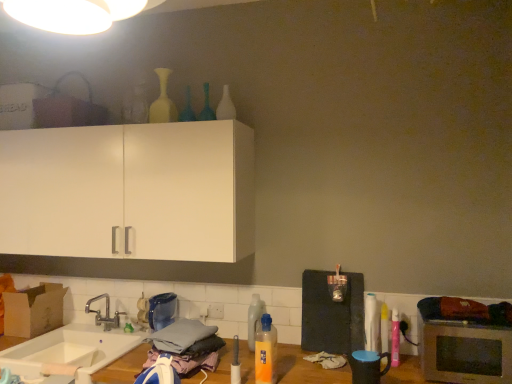
Question: In terms of size, does silver metallic microwave oven at lower right appear bigger or smaller than matte white vase at upper center, the first bottle from the left?

Choices:
 (A) big
 (B) small

Answer: (A)

Question: Choose the correct answer: Is silver metallic microwave oven at lower right inside matte white vase at upper center, the first bottle from the left, or outside it?

Choices:
 (A) inside
 (B) outside

Answer: (B)

Question: Estimate the real-world distances between objects in this image. Which object is closer to the white glossy bottle at right, which is counted as the second bottle, starting from the right?

Choices:
 (A) translucent glass bottle at upper center, arranged as the sixth bottle when viewed from the right
 (B) gray fabric clothes at lower center
 (C) white ceramic sink at lower left
 (D) silver metallic faucet at lower left
 (E) translucent plastic bottle at center, the fifth bottle when ordered from left to right

Answer: (E)

Question: Which is nearer to the pink plastic spray can at right, the 8th bottle when ordered from left to right?

Choices:
 (A) matte white vase at upper center, which ranks as the eighth bottle in right-to-left order
 (B) silver metallic faucet at lower left
 (C) gray fabric clothes at lower center
 (D) translucent plastic bottle at center, the 4th bottle viewed from the right
 (E) white glossy bottle at right, which is counted as the second bottle, starting from the right

Answer: (E)